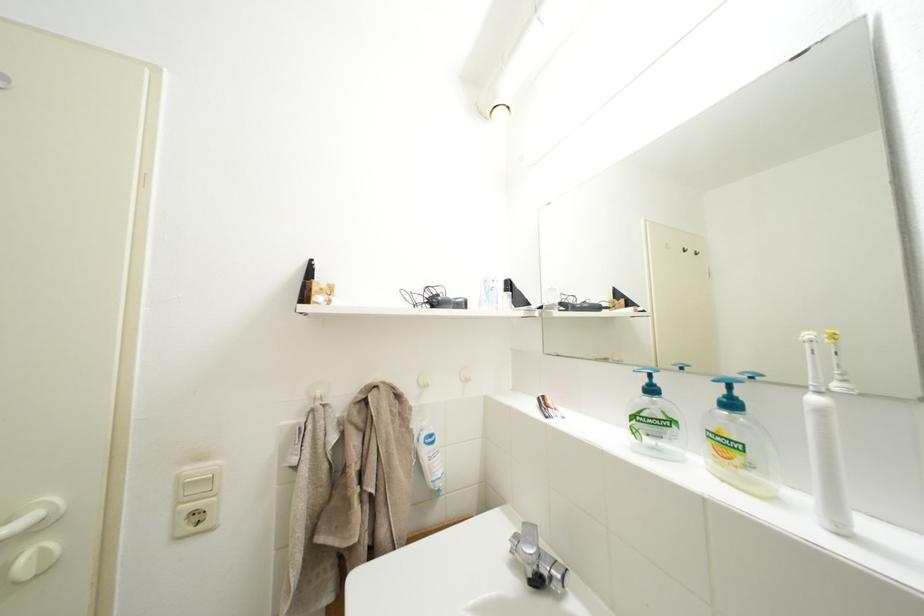
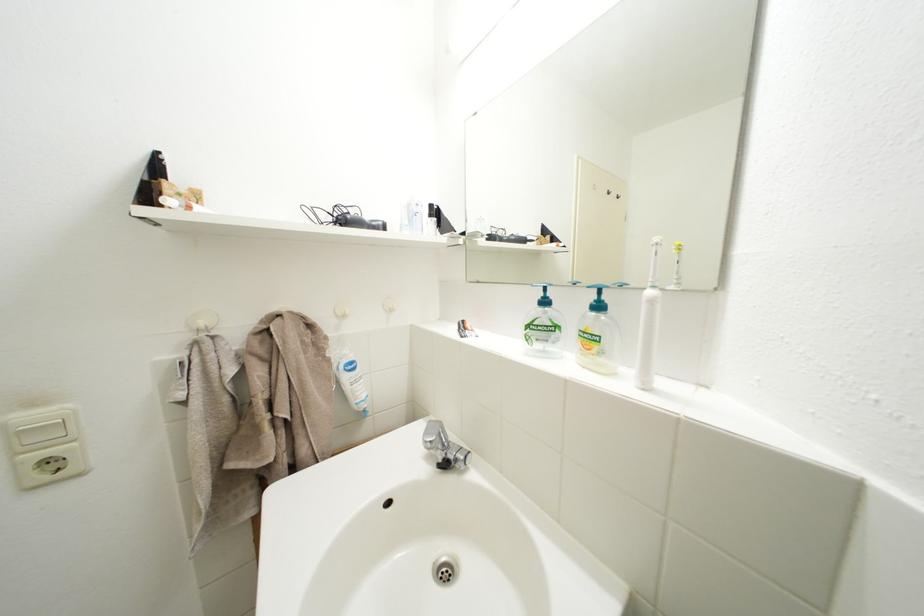
Where in the second image is the point corresponding to point (467, 306) from the first image?

(383, 228)